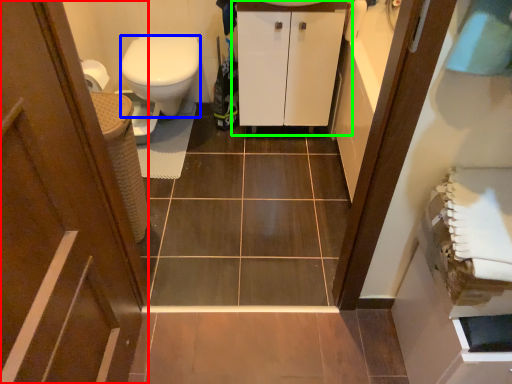
Question: Which is farther away from door (highlighted by a red box)? bidet (highlighted by a blue box) or bathroom cabinet (highlighted by a green box)?

Choices:
 (A) bidet
 (B) bathroom cabinet

Answer: (B)